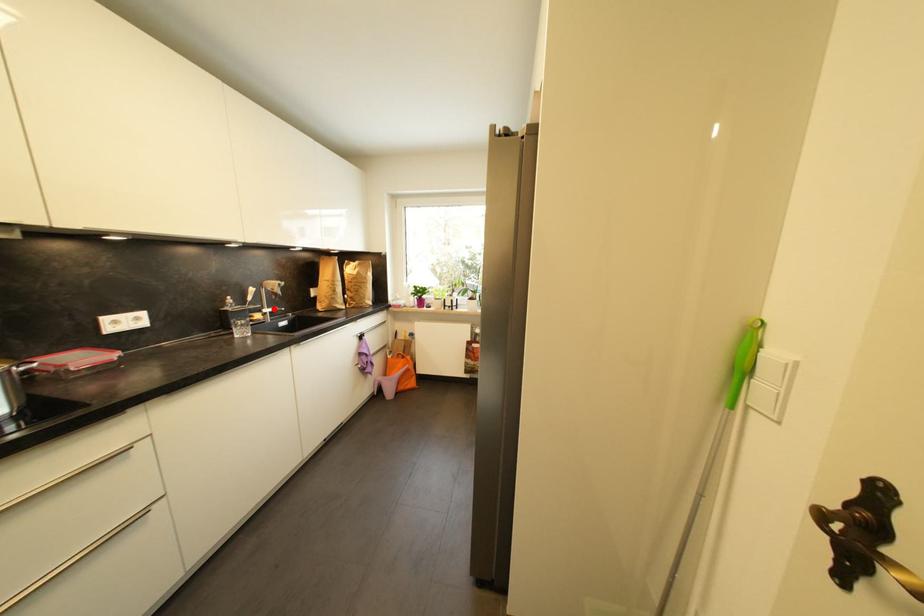
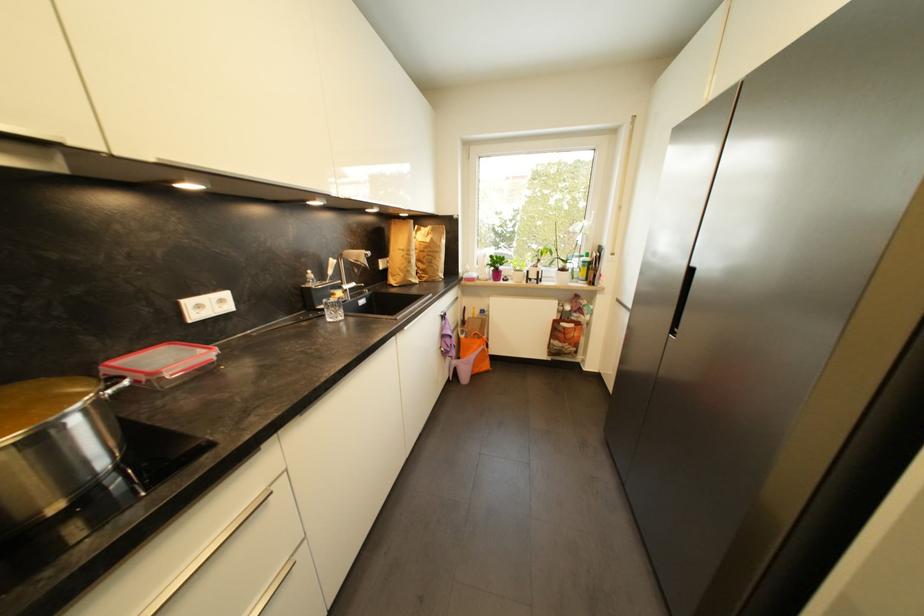
In the second image, find the point that corresponds to the highlighted location in the first image.

(353, 285)